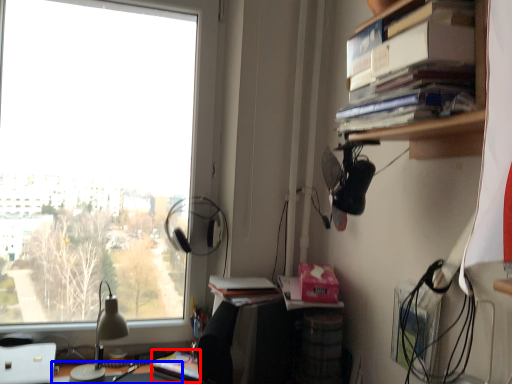
Question: Among these objects, which one is farthest to the camera, paperback book (highlighted by a red box) or desk (highlighted by a blue box)?

Choices:
 (A) paperback book
 (B) desk

Answer: (A)